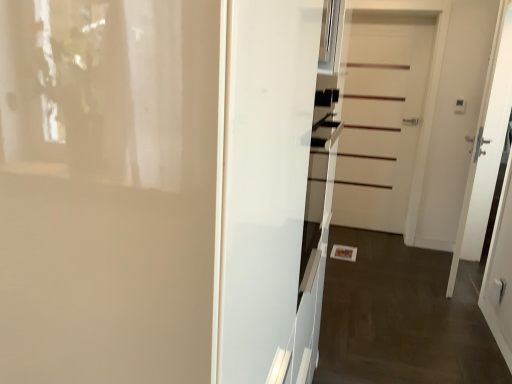
Identify the location of white glossy door at center, placed as the 3th door when sorted from right to left. This screenshot has width=512, height=384. (108, 189).

Describe the element at coordinates (108, 189) in the screenshot. I see `white glossy door at center, placed as the 3th door when sorted from right to left` at that location.

I want to click on white matte door at center, which ranks as the third door in left-to-right order, so click(x=455, y=121).

Where is `white glossy oven at center`? This screenshot has height=384, width=512. white glossy oven at center is located at coordinates (319, 182).

How distant is white matte door at center, which appears as the first door when viewed from the right, from white glossy door at center, placed as the 3th door when sorted from right to left?

white matte door at center, which appears as the first door when viewed from the right, is 3.73 meters from white glossy door at center, placed as the 3th door when sorted from right to left.

Is white matte door at center, which ranks as the third door in left-to-right order, positioned in front of white glossy door at center, which ranks as the 1th door in front-to-back order?

No, white matte door at center, which ranks as the third door in left-to-right order, is further to the viewer.

Is white matte door at center, which ranks as the third door in left-to-right order, taller than white glossy door at center, the third door in the back-to-front sequence?

Correct, white matte door at center, which ranks as the third door in left-to-right order, is much taller as white glossy door at center, the third door in the back-to-front sequence.

From the image's perspective, is white matte door at center, which ranks as the third door in left-to-right order, under white glossy door at center, placed as the 3th door when sorted from right to left?

Actually, white matte door at center, which ranks as the third door in left-to-right order, appears above white glossy door at center, placed as the 3th door when sorted from right to left, in the image.

Is white matte door at center, marked as the 1th door in a back-to-front arrangement, positioned far away from white glossy door at center, acting as the 1th door starting from the left?

Yes.

How many degrees apart are the facing directions of white matte door at center, the 2th door viewed from the left, and white glossy door at center, which ranks as the 1th door in front-to-back order?

There is a 89.6-degree angle between the facing directions of white matte door at center, the 2th door viewed from the left, and white glossy door at center, which ranks as the 1th door in front-to-back order.

Which of these two, white matte door at center, marked as the 1th door in a back-to-front arrangement, or white glossy door at center, acting as the 1th door starting from the left, is thinner?

white matte door at center, marked as the 1th door in a back-to-front arrangement, is thinner.

Which is nearer, (x=391, y=139) or (x=98, y=319)?

The point (x=98, y=319) is closer.

Considering the sizes of objects white glossy door at center, acting as the 1th door starting from the left, and white matte door at center, marked as the 1th door in a back-to-front arrangement, in the image provided, who is bigger, white glossy door at center, acting as the 1th door starting from the left, or white matte door at center, marked as the 1th door in a back-to-front arrangement,?

With larger size is white glossy door at center, acting as the 1th door starting from the left.

Is there a large distance between white glossy door at center, which ranks as the 1th door in front-to-back order, and white matte door at center, which appears as the third door when viewed from the front?

Absolutely, white glossy door at center, which ranks as the 1th door in front-to-back order, is distant from white matte door at center, which appears as the third door when viewed from the front.

From the picture: Which is more distant, [19,232] or [349,159]?

The point [349,159] is farther from the camera.

Which is behind, white glossy door at center, acting as the 1th door starting from the left, or white matte door at center, the 2th door viewed from the left?

white matte door at center, the 2th door viewed from the left, is more distant.

Would you say white glossy door at center, which ranks as the 1th door in front-to-back order, is outside white matte door at center, positioned as the 2th door in back-to-front order?

Absolutely, white glossy door at center, which ranks as the 1th door in front-to-back order, is external to white matte door at center, positioned as the 2th door in back-to-front order.

Which point is more distant from viewer, (160, 122) or (451, 180)?

Point (451, 180)

Is white glossy door at center, acting as the 1th door starting from the left, to the left of white matte door at center, which ranks as the third door in left-to-right order, from the viewer's perspective?

Indeed, white glossy door at center, acting as the 1th door starting from the left, is positioned on the left side of white matte door at center, which ranks as the third door in left-to-right order.

How many degrees apart are the facing directions of white glossy oven at center and white matte door at center, which appears as the first door when viewed from the right?

157 degrees.

From the image's perspective, who appears lower, white glossy oven at center or white matte door at center, which appears as the first door when viewed from the right?

white glossy oven at center, from the image's perspective.

Which object is positioned more to the right, white glossy oven at center or white matte door at center, positioned as the 2th door in back-to-front order?

Positioned to the right is white matte door at center, positioned as the 2th door in back-to-front order.

Is white glossy oven at center aimed at white matte door at center, which appears as the first door when viewed from the right?

No, white glossy oven at center is not turned towards white matte door at center, which appears as the first door when viewed from the right.

Is white glossy oven at center positioned with its back to white glossy door at center, the third door in the back-to-front sequence?

Yes, white glossy oven at center's orientation is away from white glossy door at center, the third door in the back-to-front sequence.

Based on the photo, from a real-world perspective, is white glossy oven at center physically located above or below white glossy door at center, placed as the 3th door when sorted from right to left?

white glossy oven at center is situated higher than white glossy door at center, placed as the 3th door when sorted from right to left, in the real world.

Between white glossy oven at center and white glossy door at center, acting as the 1th door starting from the left, which one is positioned behind?

Positioned behind is white glossy oven at center.

Find the location of `the 3rd door below the white glossy oven at center (from a real-world perspective)`. the 3rd door below the white glossy oven at center (from a real-world perspective) is located at coordinates (108, 189).

Is white glossy door at center, placed as the 3th door when sorted from right to left, wider than white glossy oven at center?

Indeed, white glossy door at center, placed as the 3th door when sorted from right to left, has a greater width compared to white glossy oven at center.

Locate an element on the screen. The width and height of the screenshot is (512, 384). oven that is on the right side of white glossy door at center, which ranks as the 1th door in front-to-back order is located at coordinates (319, 182).

From a real-world perspective, is white glossy door at center, placed as the 3th door when sorted from right to left, located higher than white glossy oven at center?

No, from a real-world perspective, white glossy door at center, placed as the 3th door when sorted from right to left, is not above white glossy oven at center.

Starting from the white glossy door at center, acting as the 1th door starting from the left, which door is the 1st one behind? Please provide its 2D coordinates.

[(455, 121)]

Where is `door to the left of white matte door at center, which appears as the third door when viewed from the front`? The width and height of the screenshot is (512, 384). door to the left of white matte door at center, which appears as the third door when viewed from the front is located at coordinates (108, 189).

Based on the photo, based on their spatial positions, is white matte door at center, which ranks as the third door in left-to-right order, or white glossy door at center, the third door in the back-to-front sequence, closer to white matte door at center, the 2th door viewed from the left?

white matte door at center, which ranks as the third door in left-to-right order.

When comparing their distances from white glossy oven at center, does white matte door at center, positioned as the 2th door in back-to-front order, or white glossy door at center, acting as the 1th door starting from the left, seem closer?

white glossy door at center, acting as the 1th door starting from the left, is positioned closer to the anchor white glossy oven at center.

From the image, which object appears to be nearer to white glossy oven at center, white matte door at center, which appears as the third door when viewed from the front, or white glossy door at center, placed as the 3th door when sorted from right to left?

The object closer to white glossy oven at center is white glossy door at center, placed as the 3th door when sorted from right to left.

From the image, which object appears to be farther from white glossy door at center, placed as the 3th door when sorted from right to left, white matte door at center, the 2th door viewed from the left, or white glossy oven at center?

Based on the image, white matte door at center, the 2th door viewed from the left, appears to be further to white glossy door at center, placed as the 3th door when sorted from right to left.

From the picture: Estimate the real-world distances between objects in this image. Which object is further from white glossy oven at center, white glossy door at center, which ranks as the 1th door in front-to-back order, or white matte door at center, the 2th door viewed from the left?

white matte door at center, the 2th door viewed from the left, is further to white glossy oven at center.

When comparing their distances from white matte door at center, marked as the second door in a right-to-left arrangement, does white matte door at center, which ranks as the third door in left-to-right order, or white glossy oven at center seem further?

white glossy oven at center.

Estimate the real-world distances between objects in this image. Which object is closer to white matte door at center, marked as the second door in a right-to-left arrangement, white glossy door at center, which ranks as the 1th door in front-to-back order, or white glossy oven at center?

white glossy oven at center lies closer to white matte door at center, marked as the second door in a right-to-left arrangement, than the other object.

Looking at the image, which one is located closer to white matte door at center, which ranks as the third door in left-to-right order, white glossy door at center, acting as the 1th door starting from the left, or white matte door at center, which appears as the third door when viewed from the front?

white matte door at center, which appears as the third door when viewed from the front, is closer to white matte door at center, which ranks as the third door in left-to-right order.

The height and width of the screenshot is (384, 512). Identify the location of door between white glossy oven at center and white matte door at center, marked as the second door in a right-to-left arrangement, in the front-back direction. (455, 121).

This screenshot has height=384, width=512. Find the location of `oven between white glossy door at center, which ranks as the 1th door in front-to-back order, and white matte door at center, the 2th door viewed from the left, in the front-back direction`. oven between white glossy door at center, which ranks as the 1th door in front-to-back order, and white matte door at center, the 2th door viewed from the left, in the front-back direction is located at coordinates (319, 182).

Find the location of a particular element. door between white glossy door at center, acting as the 1th door starting from the left, and white matte door at center, marked as the second door in a right-to-left arrangement, from front to back is located at coordinates (455, 121).

This screenshot has width=512, height=384. I want to click on oven positioned between white glossy door at center, placed as the 3th door when sorted from right to left, and white matte door at center, positioned as the 2th door in back-to-front order, from near to far, so click(319, 182).